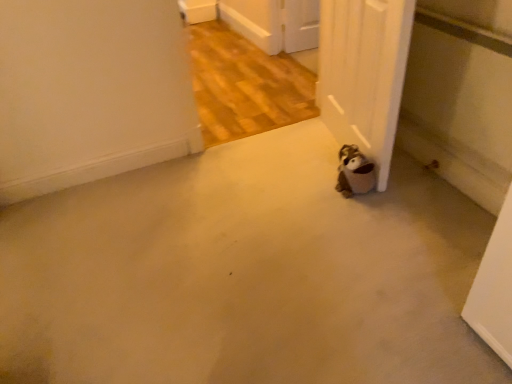
Question: Is brown plush toy at lower right next to white matte door at lower right?

Choices:
 (A) no
 (B) yes

Answer: (A)

Question: Would you consider brown plush toy at lower right to be distant from white matte door at lower right?

Choices:
 (A) no
 (B) yes

Answer: (A)

Question: Could white matte door at lower right be considered to be inside brown plush toy at lower right?

Choices:
 (A) no
 (B) yes

Answer: (A)

Question: Can you confirm if brown plush toy at lower right is shorter than white matte door at lower right?

Choices:
 (A) no
 (B) yes

Answer: (B)

Question: Is brown plush toy at lower right further to camera compared to white matte door at lower right?

Choices:
 (A) yes
 (B) no

Answer: (A)

Question: In terms of width, does white matte door at lower right look wider or thinner when compared to brown plush toy at lower right?

Choices:
 (A) wide
 (B) thin

Answer: (B)

Question: Is white matte door at lower right inside or outside of brown plush toy at lower right?

Choices:
 (A) outside
 (B) inside

Answer: (A)

Question: Visually, is white matte door at lower right positioned to the left or to the right of brown plush toy at lower right?

Choices:
 (A) right
 (B) left

Answer: (A)

Question: Looking at the image, does white matte door at lower right seem bigger or smaller compared to brown plush toy at lower right?

Choices:
 (A) big
 (B) small

Answer: (A)

Question: Looking at the image, does white matte door at lower right seem bigger or smaller compared to beige carpet at lower center?

Choices:
 (A) small
 (B) big

Answer: (A)

Question: From the image's perspective, is white matte door at lower right located above or below beige carpet at lower center?

Choices:
 (A) above
 (B) below

Answer: (A)

Question: Considering their positions, is white matte door at lower right located in front of or behind beige carpet at lower center?

Choices:
 (A) front
 (B) behind

Answer: (B)

Question: From their relative heights in the image, would you say white matte door at lower right is taller or shorter than beige carpet at lower center?

Choices:
 (A) short
 (B) tall

Answer: (B)

Question: In the image, is brown plush toy at lower right positioned in front of or behind white matte door at lower right?

Choices:
 (A) behind
 (B) front

Answer: (A)

Question: Would you say brown plush toy at lower right is to the left or to the right of white matte door at lower right in the picture?

Choices:
 (A) right
 (B) left

Answer: (B)